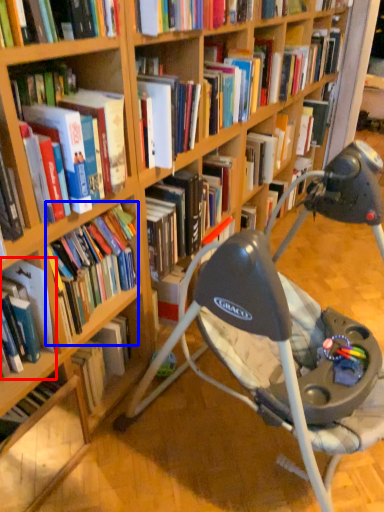
Question: Which of the following is the closest to the observer, book (highlighted by a red box) or book (highlighted by a blue box)?

Choices:
 (A) book
 (B) book

Answer: (A)